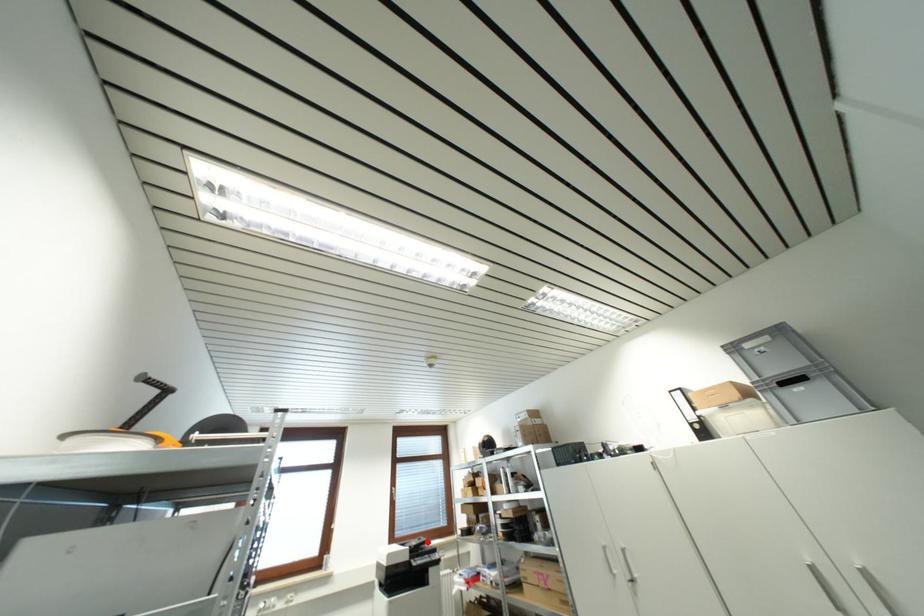
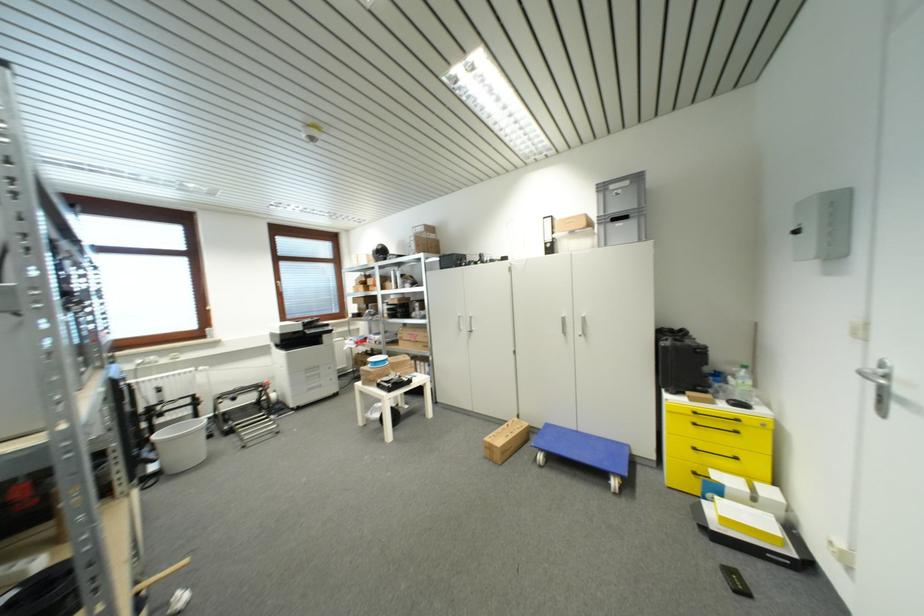
Find the pixel in the second image that matches the highlighted location in the first image.

(320, 321)